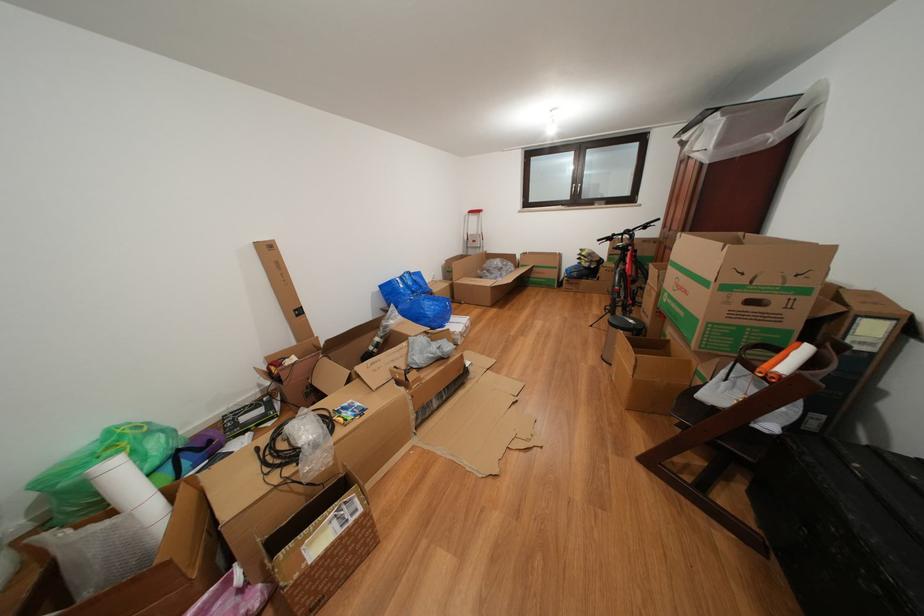
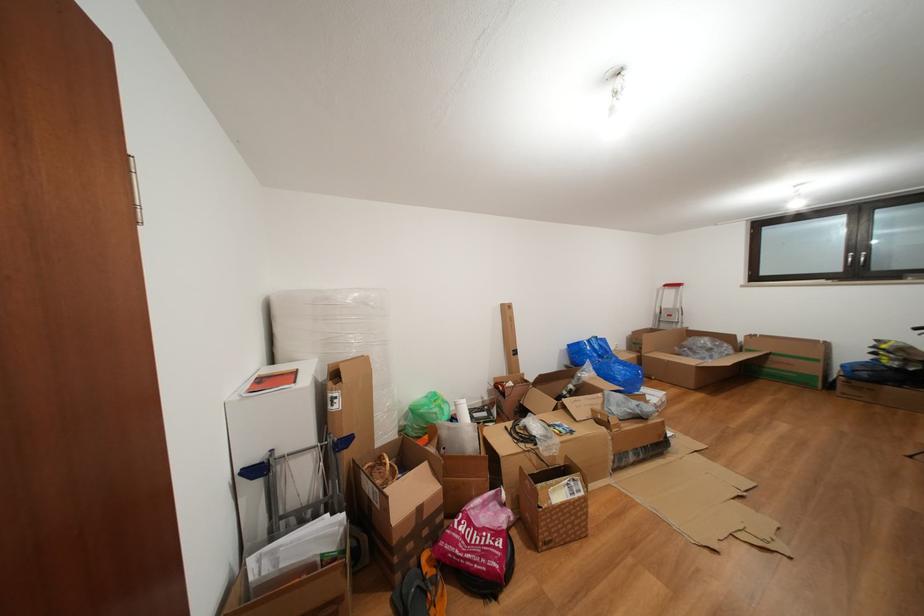
In the second image, find the point that corresponds to pixel 585 185 in the first image.

(866, 252)